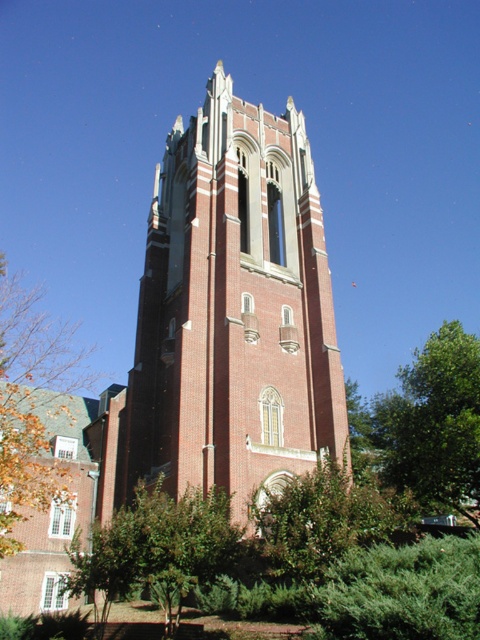
Question: Does brick tower at center appear under green leafy tree at right?

Choices:
 (A) no
 (B) yes

Answer: (A)

Question: Among these points, which one is nearest to the camera?

Choices:
 (A) (67, 356)
 (B) (220, 193)
 (C) (199, 570)
 (D) (410, 451)

Answer: (C)

Question: Which is nearer to the brown leafy tree at left?

Choices:
 (A) green leafy tree at lower center
 (B) brick tower at center

Answer: (A)

Question: Can you confirm if brick tower at center is bigger than brown leafy tree at left?

Choices:
 (A) yes
 (B) no

Answer: (B)

Question: Which point appears farthest from the camera in this image?

Choices:
 (A) (27, 314)
 (B) (290, 170)
 (C) (404, 465)

Answer: (A)

Question: Is brick tower at center to the right of brown leafy tree at left from the viewer's perspective?

Choices:
 (A) yes
 (B) no

Answer: (A)